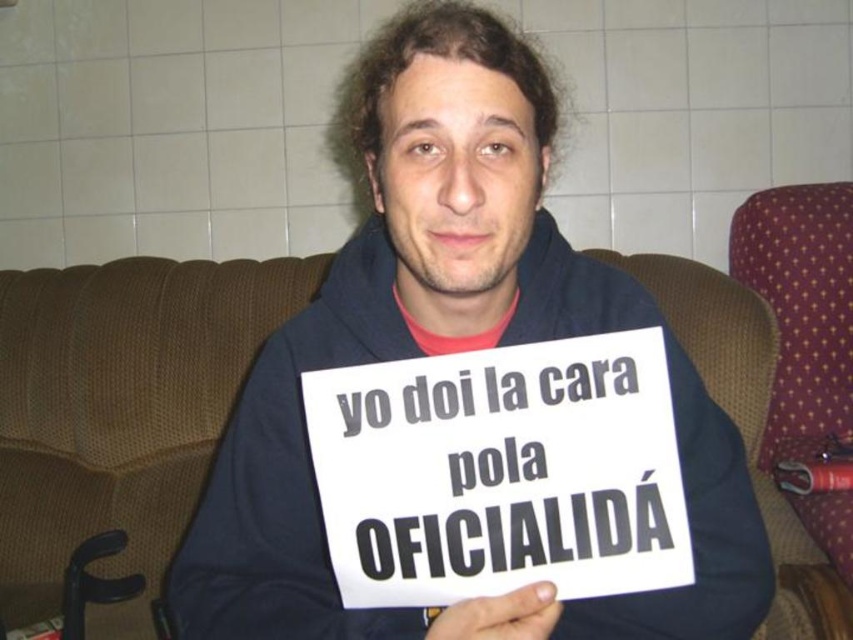
You are a photographer taking a picture of the scene. The camera is positioned so that the dark blue hoodie at center and the white paper sign at center are both in frame. Based on their positions, which object is closer to the left edge of the photo?

The dark blue hoodie at center is to the left of the white paper sign at center, so it is closer to the left edge of the photo.

Based on the photo, you are standing in the room where the person is holding the sign. The dark blue hoodie at center is located at point (450,352). Can you tell me the coordinates of the dark blue hoodie at center?

The dark blue hoodie at center is located at point (450,352).

You are trying to hang a small hook on the wall behind the dark blue hoodie at center and the white paper sign at center. Which object should you avoid placing the hook near to ensure it doesn

The dark blue hoodie at center is wider than the white paper sign at center, so you should avoid placing the hook near the dark blue hoodie at center to ensure it doesn